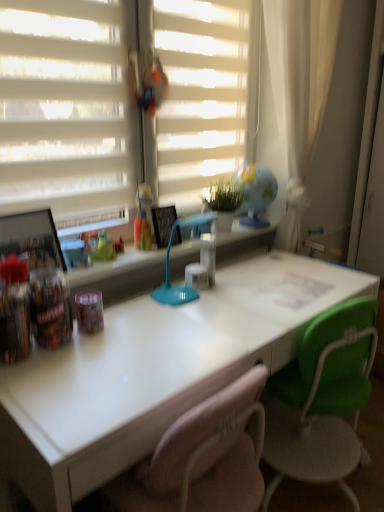
Question: Can you confirm if translucent plastic cup at upper center is positioned to the left of blue plastic table lamp at center?

Choices:
 (A) no
 (B) yes

Answer: (B)

Question: Is translucent plastic cup at upper center thinner than blue plastic table lamp at center?

Choices:
 (A) no
 (B) yes

Answer: (B)

Question: Would you say translucent plastic cup at upper center contains blue plastic table lamp at center?

Choices:
 (A) no
 (B) yes

Answer: (A)

Question: Is translucent plastic cup at upper center positioned before blue plastic table lamp at center?

Choices:
 (A) no
 (B) yes

Answer: (A)

Question: Can you confirm if translucent plastic cup at upper center is wider than blue plastic table lamp at center?

Choices:
 (A) yes
 (B) no

Answer: (B)

Question: In the image, is white matte blinds at upper center on the left side or the right side of white matte shutter at upper left?

Choices:
 (A) left
 (B) right

Answer: (B)

Question: In terms of width, does white matte blinds at upper center look wider or thinner when compared to white matte shutter at upper left?

Choices:
 (A) thin
 (B) wide

Answer: (A)

Question: Which is correct: white matte blinds at upper center is inside white matte shutter at upper left, or outside of it?

Choices:
 (A) inside
 (B) outside

Answer: (B)

Question: From a real-world perspective, relative to white matte shutter at upper left, is white matte blinds at upper center vertically above or below?

Choices:
 (A) below
 (B) above

Answer: (B)

Question: Considering the positions of green fabric chair at center and white matte blinds at upper center in the image, is green fabric chair at center bigger or smaller than white matte blinds at upper center?

Choices:
 (A) small
 (B) big

Answer: (B)

Question: Do you think green fabric chair at center is within white matte blinds at upper center, or outside of it?

Choices:
 (A) outside
 (B) inside

Answer: (A)

Question: From a real-world perspective, is green fabric chair at center physically located above or below white matte blinds at upper center?

Choices:
 (A) above
 (B) below

Answer: (B)

Question: Considering the relative positions of green fabric chair at center and white matte blinds at upper center in the image provided, is green fabric chair at center to the left or to the right of white matte blinds at upper center?

Choices:
 (A) left
 (B) right

Answer: (B)

Question: From a real-world perspective, relative to white matte blinds at upper center, is white matte shutter at upper left vertically above or below?

Choices:
 (A) below
 (B) above

Answer: (A)

Question: In terms of height, does white matte shutter at upper left look taller or shorter compared to white matte blinds at upper center?

Choices:
 (A) tall
 (B) short

Answer: (B)